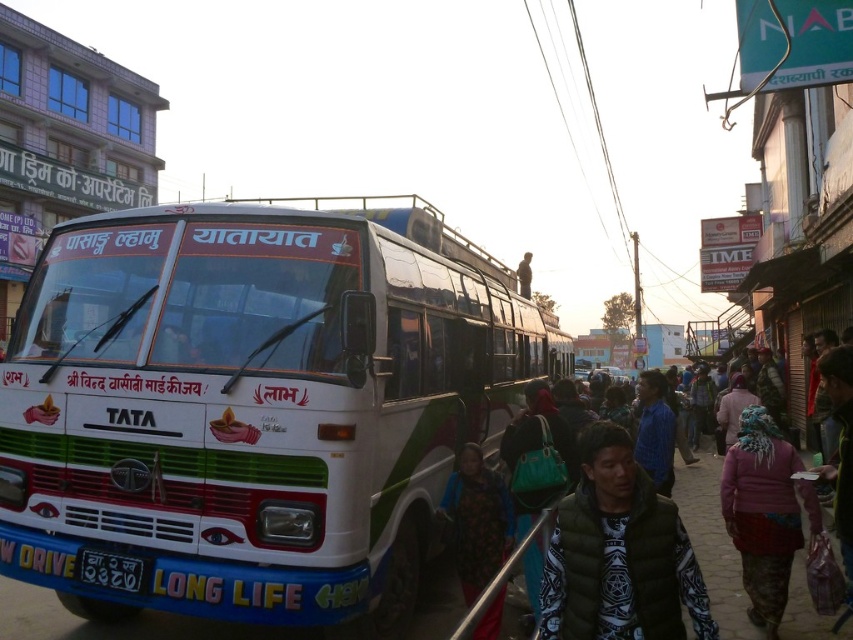
Question: Among these points, which one is farthest from the camera?

Choices:
 (A) (589, 442)
 (B) (97, 388)

Answer: (B)

Question: In this image, where is pink fabric headscarf at lower right located relative to floral fabric shawl at center?

Choices:
 (A) above
 (B) below

Answer: (A)

Question: Which point is closer to the camera?

Choices:
 (A) tap(639, 545)
 (B) tap(286, 456)

Answer: (A)

Question: Is the position of white glossy bus at center less distant than that of dark green vest at center?

Choices:
 (A) no
 (B) yes

Answer: (A)

Question: Which object is closer to the camera taking this photo?

Choices:
 (A) white plastic license plate at lower left
 (B) white glossy bus at center
 (C) dark green vest at center

Answer: (C)

Question: Is dark green vest at center to the left of white plastic license plate at lower left from the viewer's perspective?

Choices:
 (A) yes
 (B) no

Answer: (B)